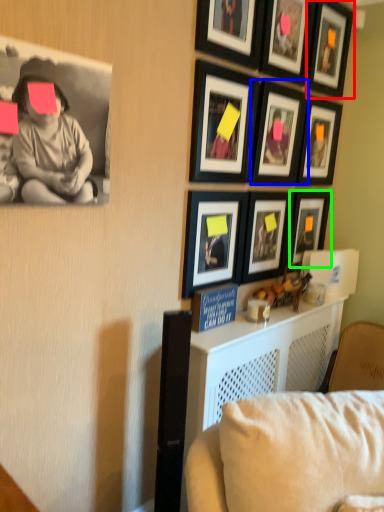
Question: Which is farther away from picture frame (highlighted by a red box)? picture frame (highlighted by a blue box) or picture frame (highlighted by a green box)?

Choices:
 (A) picture frame
 (B) picture frame

Answer: (B)